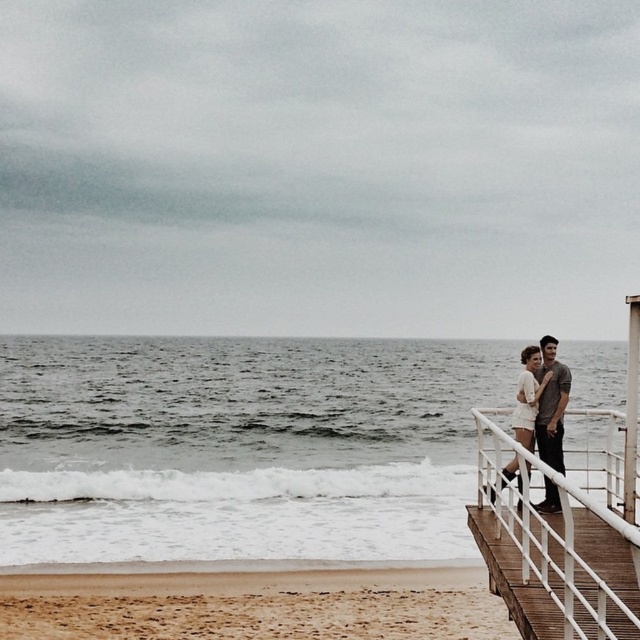
Can you confirm if smooth sand beach at lower left is thinner than white wooden railing at right?

Yes, smooth sand beach at lower left is thinner than white wooden railing at right.

What do you see at coordinates (256, 604) in the screenshot?
I see `smooth sand beach at lower left` at bounding box center [256, 604].

Where is `smooth sand beach at lower left`? smooth sand beach at lower left is located at coordinates (256, 604).

Is the position of white wooden railing at right more distant than that of white cotton dress at right?

No, it is not.

Find the location of a particular element. The width and height of the screenshot is (640, 640). white wooden railing at right is located at coordinates (560, 532).

Who is lower down, white wooden railing at right or dark gray jeans at right?

white wooden railing at right

Between point (614, 492) and point (564, 388), which one is positioned in front?

Point (564, 388) is in front.

Is point (636, 477) positioned before point (544, 440)?

That is True.

This screenshot has height=640, width=640. I want to click on white wooden railing at right, so click(x=560, y=532).